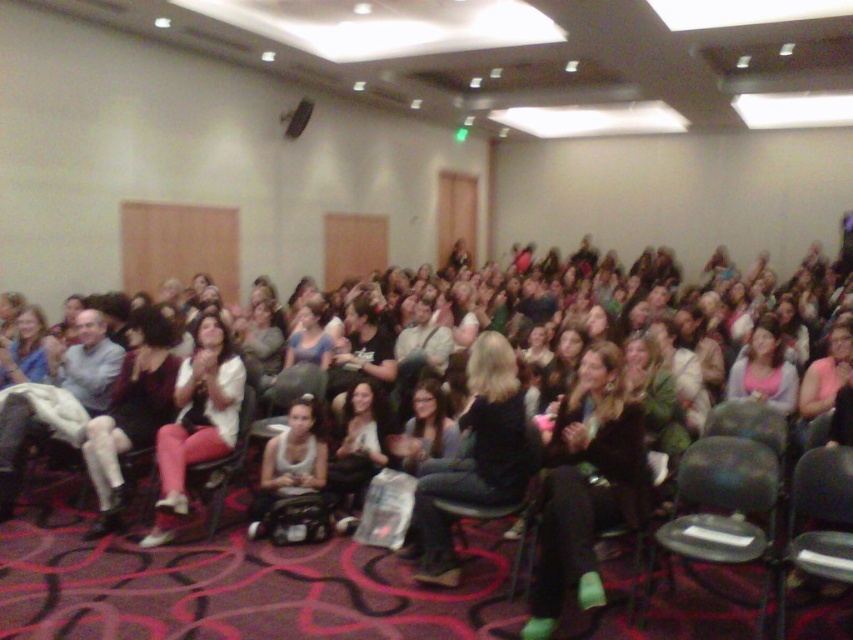
Question: Does metallic gray chair at lower right appear on the left side of velvet dark gray chair at center?

Choices:
 (A) no
 (B) yes

Answer: (B)

Question: Which of the following is the farthest from the observer?

Choices:
 (A) black fabric chair at center
 (B) metallic gray chair at lower right
 (C) matte white tank top at center

Answer: (C)

Question: Does metallic gray chair at lower right appear on the right side of black plastic chair at lower right?

Choices:
 (A) no
 (B) yes

Answer: (A)

Question: Which of these objects is positioned farthest from the matte blue dress at lower left?

Choices:
 (A) black fabric chair at center
 (B) metallic gray chair at lower right

Answer: (B)

Question: Which of the following is the closest to the observer?

Choices:
 (A) metallic gray chair at center
 (B) pink matte shirt at center
 (C) matte white shirt at center

Answer: (A)

Question: Does matte black top at center appear on the left side of velvet dark gray chair at center?

Choices:
 (A) yes
 (B) no

Answer: (A)